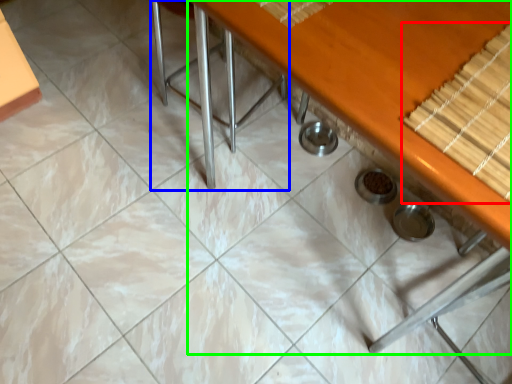
Question: Considering the real-world distances, which object is closest to wood (highlighted by a red box)? chair (highlighted by a blue box) or table (highlighted by a green box).

Choices:
 (A) chair
 (B) table

Answer: (B)